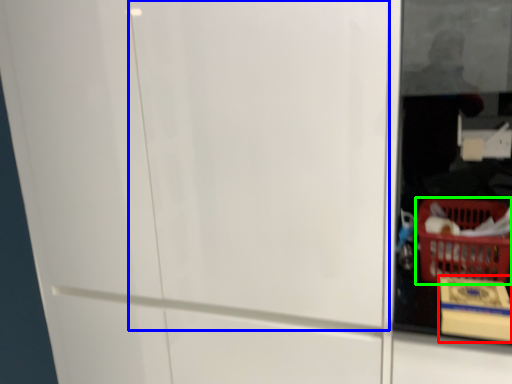
Question: Considering the real-world distances, which object is closest to cardboard box (highlighted by a red box)? screen door (highlighted by a blue box) or basket (highlighted by a green box).

Choices:
 (A) screen door
 (B) basket

Answer: (B)